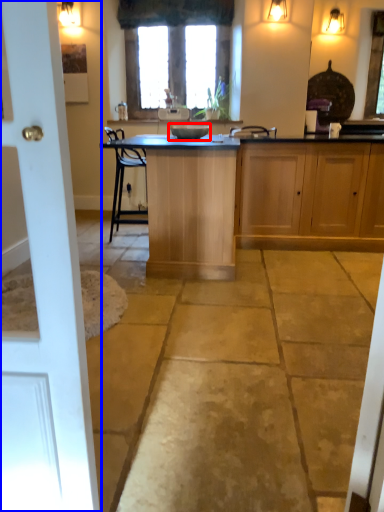
Question: Among these objects, which one is farthest to the camera, appliance (highlighted by a red box) or door (highlighted by a blue box)?

Choices:
 (A) appliance
 (B) door

Answer: (A)